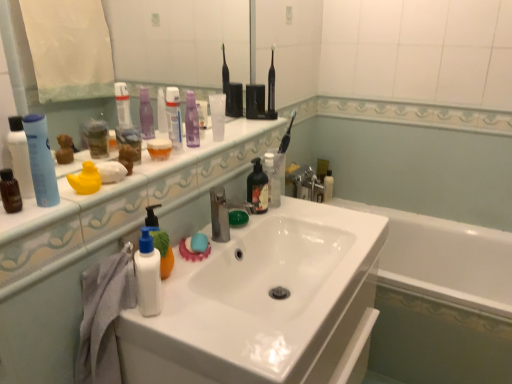
This screenshot has height=384, width=512. Identify the location of vacant area that lies in front of translucent plastic mouthwash at center, marked as the third mouthwash in a left-to-right arrangement. (153, 169).